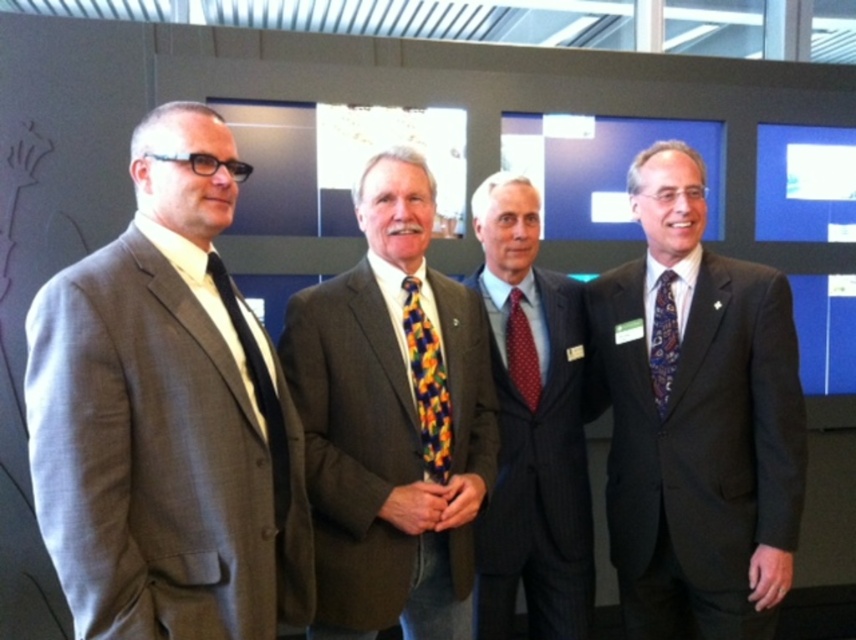
Based on the scene description, which tie is positioned lower in the image, the multicolored patterned tie at center or the matte black tie at left?

The multicolored patterned tie at center is located below the matte black tie at left, so it is positioned lower in the image.

You are a photographer at a corporate event and need to adjust lighting to ensure both the multicolored patterned tie at center and the matte black tie at left are visible. Given their sizes, which tie might require more focused lighting to stand out?

The multicolored patterned tie at center is larger in size than the matte black tie at left, so it may require more focused lighting to ensure its patterns and size are clearly visible.

You are standing 5 feet away from the camera. You want to move closer to the point at coordinates point (x=443, y=428). Will you be able to reach that point without moving past it?

The point (x=443, y=428) is 6.00 feet away from the camera. Since you are currently 5 feet away from the camera, you are already closer to the camera than the point. To reach the point, you would need to move away from the camera, not closer. Therefore, you cannot reach the point by moving closer without passing it.